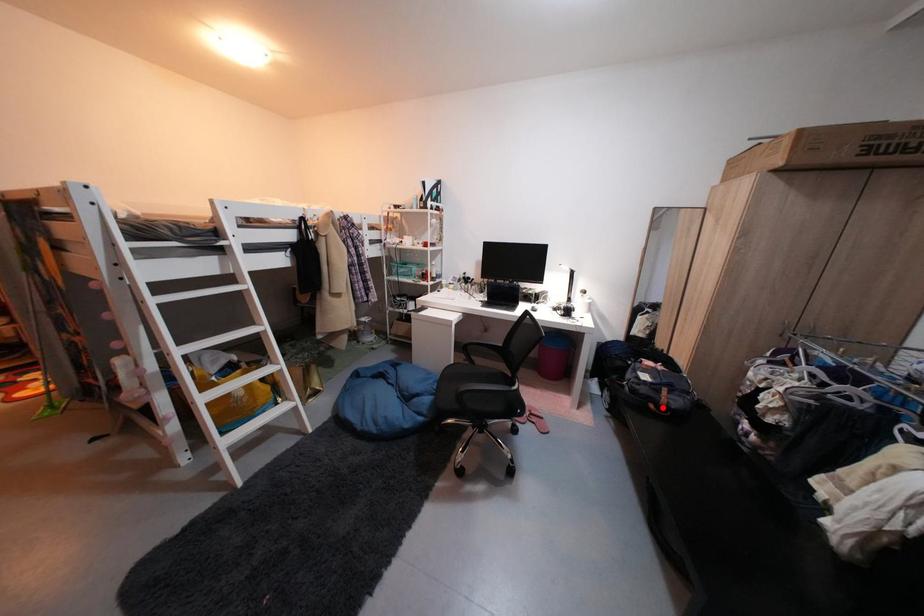
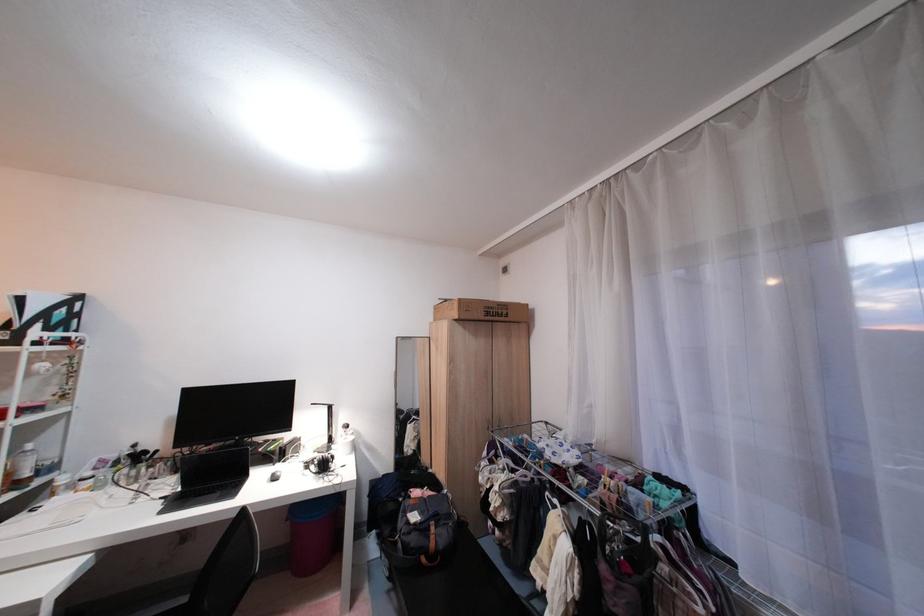
Locate, in the second image, the point that corresponds to the highlighted location in the first image.

(434, 561)